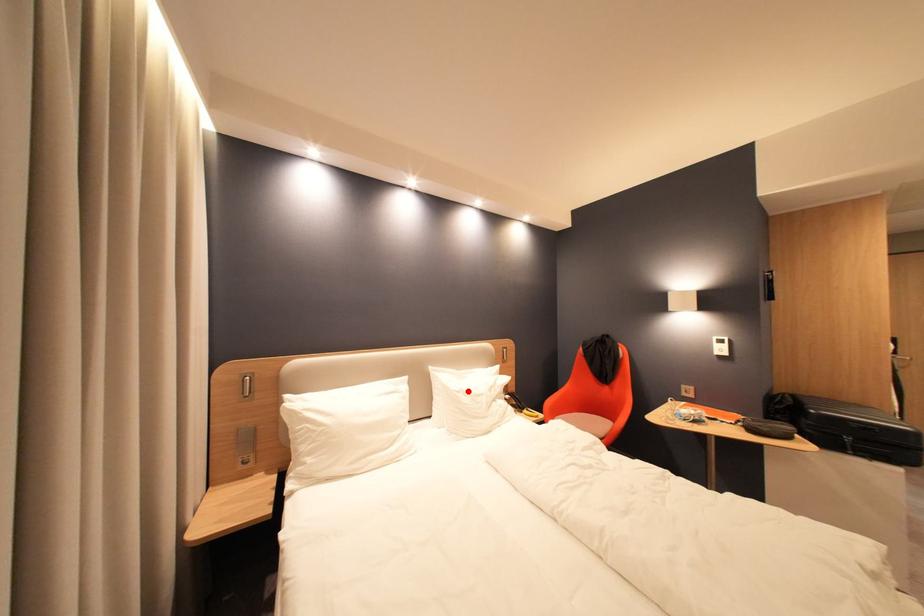
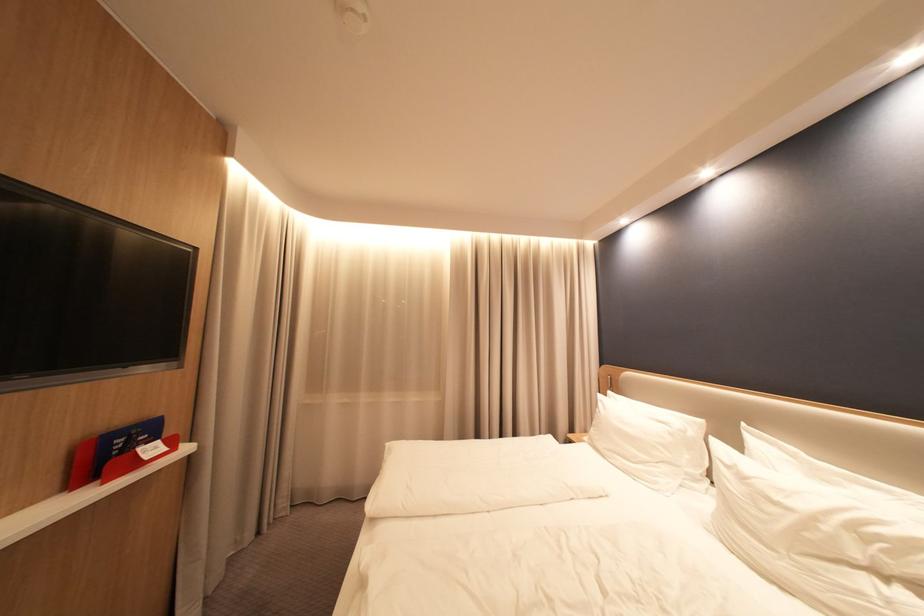
Locate, in the second image, the point that corresponds to the highlighted location in the first image.

(737, 464)